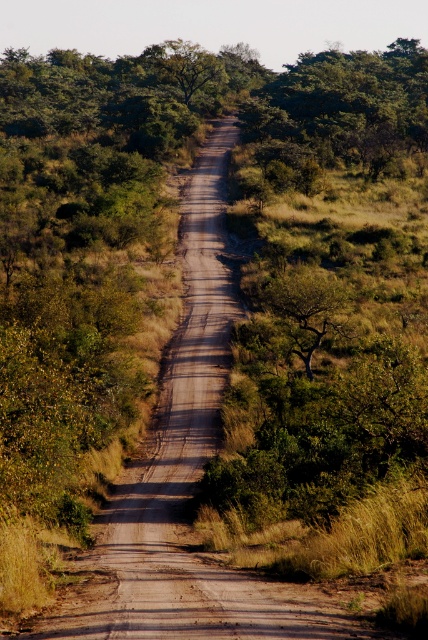
Question: Which point is closer to the camera?

Choices:
 (A) green leafy tree at center
 (B) green leafy tree at upper center

Answer: (A)

Question: Does green leafy tree at upper center appear on the left side of green leafy tree at center?

Choices:
 (A) yes
 (B) no

Answer: (B)

Question: Does green leafy tree at upper center appear over green leafy tree at center?

Choices:
 (A) no
 (B) yes

Answer: (B)

Question: Among these points, which one is nearest to the camera?

Choices:
 (A) (299, 349)
 (B) (409, 84)

Answer: (A)

Question: Can you confirm if green leafy tree at upper center is bigger than green leafy tree at center?

Choices:
 (A) no
 (B) yes

Answer: (B)